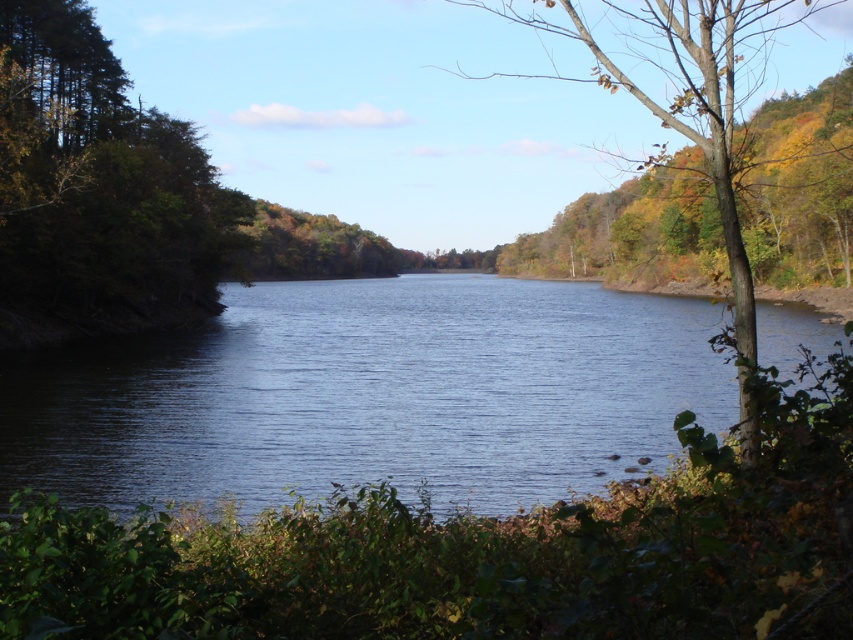
You are planning to take a photo of the blue water at center and the green matte tree at left. Which object should you focus on first if you want to capture both in a single frame without moving the camera?

The blue water at center is bigger than the green matte tree at left, so you should focus on the blue water at center first to ensure it fills the frame appropriately before adjusting for the smaller tree.

You are standing at the edge of the scene and want to walk towards the blue water at center. Which direction should you head relative to the green matte tree at left?

The blue water at center is positioned on the right side of the green matte tree at left, so you should head to the right of the green matte tree at left to reach the blue water at center.

You are standing at the center of the image and want to locate the green matte tree at left. Which direction should you look to find it?

The green matte tree at left is located at point (97, 182), which is to the left side of the image. Therefore, you should look to your left to find it.